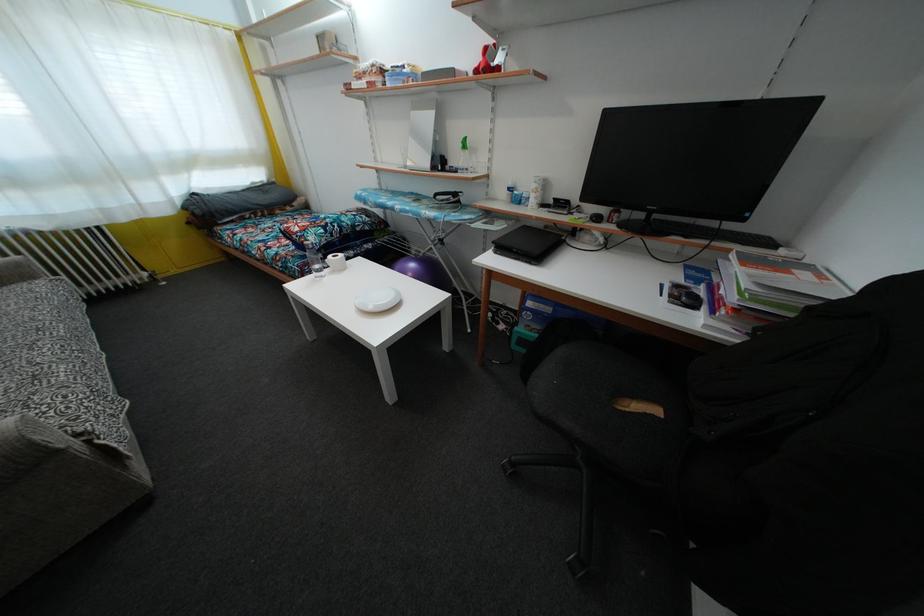
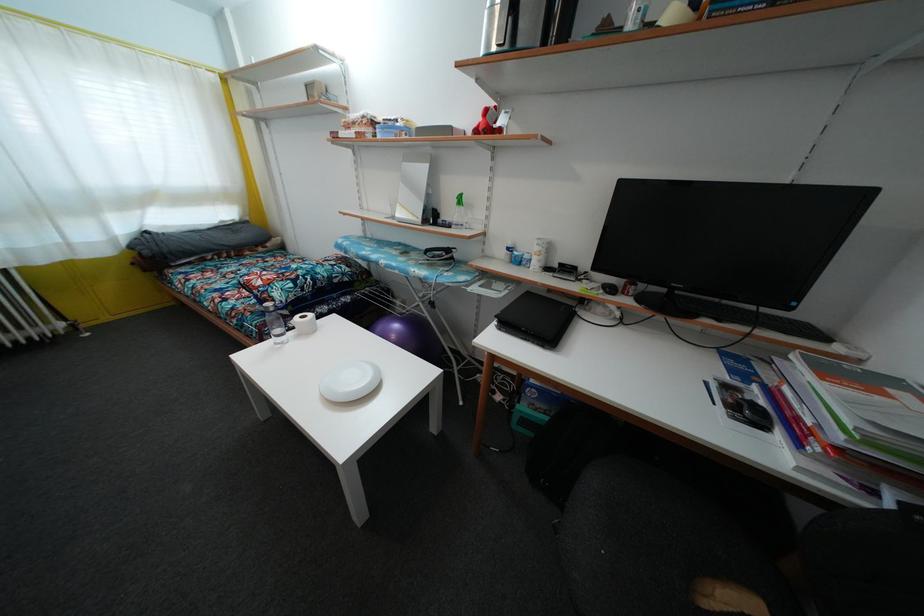
In the second image, find the point that corresponds to [506,254] in the first image.

(512, 331)